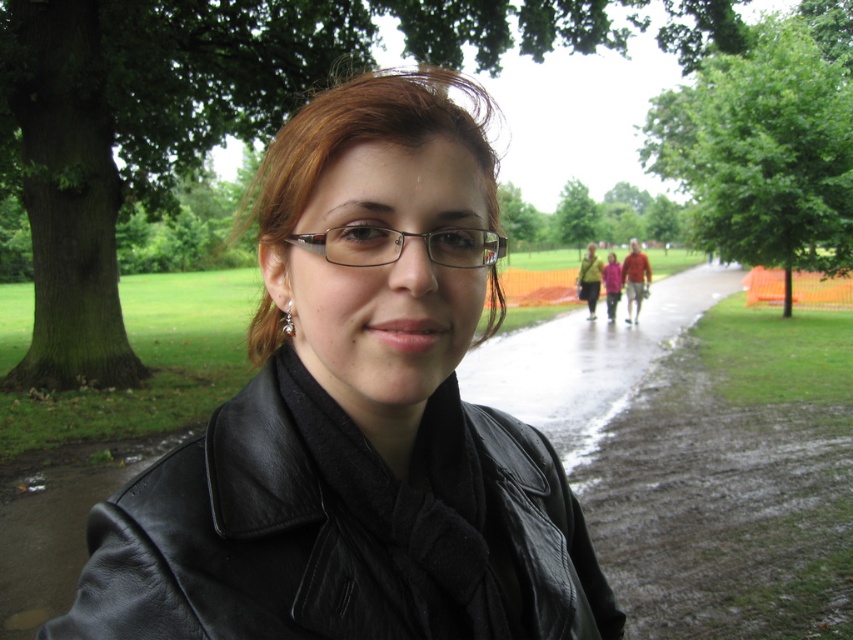
You are standing at the point with coordinates point (x=648, y=268) and want to walk to the point with coordinates point (x=735, y=145). Given that the path curves gently through the area, will you have to walk forward or backward to reach your destination?

Since point (x=735, y=145) is behind point (x=648, y=268), you will have to walk backward to reach your destination.

You are a fashion photographer who wants to capture the contrast between the black leather jacket at center and the matte green jacket at center. Which jacket is located to the left of the other?

The black leather jacket at center is positioned on the left side of matte green jacket at center.